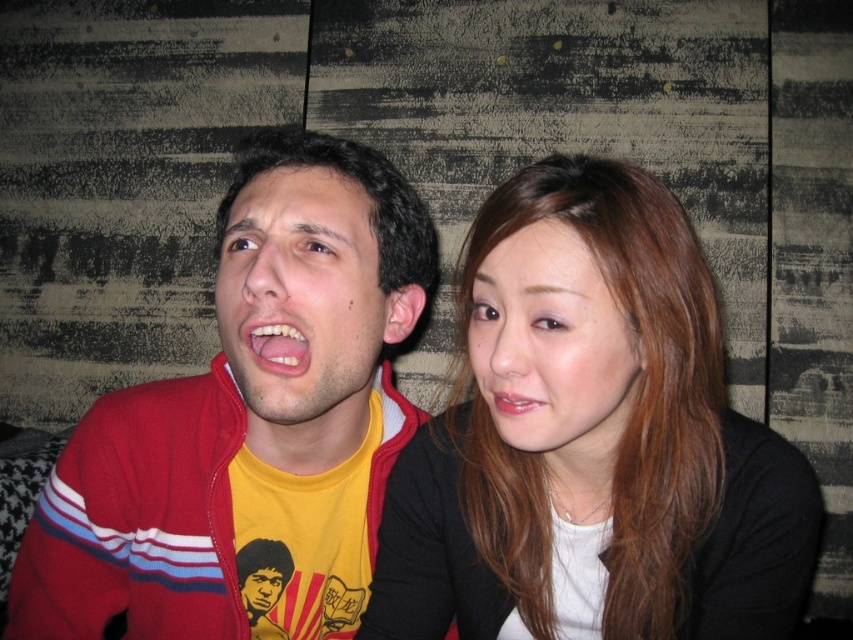
You are a photographer trying to capture a closeup of the smooth brown hair at center without the matte pink lips at center appearing in the frame. Based on their positions, is this possible?

The smooth brown hair at center is in front of the matte pink lips at center, so it would block the view of the matte pink lips at center in the closeup.

You are standing at the point labeled point (306, 365) and want to move to the wall behind you. The wall is 25 inches away from your current position. Can you reach the wall without moving your feet?

The distance between point (306, 365) and the viewer is 23.09 inches, which is less than the 25 inches to the wall. Therefore, you can reach the wall without moving your feet.

You are standing in front of the image and want to touch the point that is closest to you. The image has a man on the left wearing a red jacket with white and blue stripes on the sleeves over a yellow graphic tshirt, and a woman next to him with long brown hair and a black top with white inner layer. Which object from the list below is the closest to you? The options are the man on the left or the point at (413,452).

The point at (413,452) is 27.97 inches from the viewer, so it is closer than the man on the left. Therefore, the closest object to you is the point at (413,452).